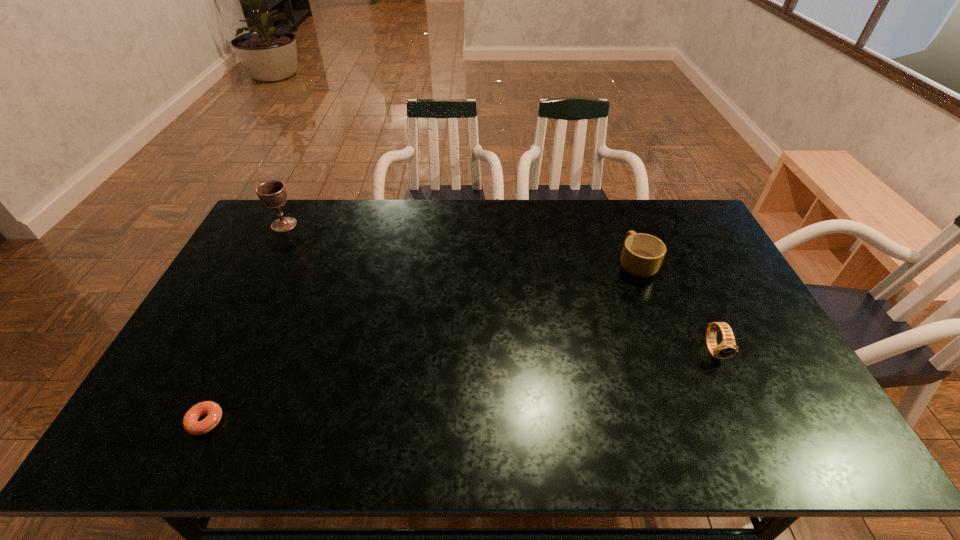
Identify the location of the farthest object. click(x=273, y=194).

In order to click on chalice in this screenshot , I will do `click(273, 194)`.

Identify the location of the second farthest object. (642, 255).

You are a GUI agent. You are given a task and a screenshot of the screen. Output one action in this format:
    pyautogui.click(x=<x>, y=<y>)
    Task: Click on the mug
    This screenshot has height=540, width=960.
    Given the screenshot: What is the action you would take?
    pyautogui.click(x=642, y=255)

Locate an element on the screen. Image resolution: width=960 pixels, height=540 pixels. watch is located at coordinates (727, 348).

You are a GUI agent. You are given a task and a screenshot of the screen. Output one action in this format:
    pyautogui.click(x=<x>, y=<y>)
    Task: Click on the rightmost object
    
    Given the screenshot: What is the action you would take?
    pyautogui.click(x=727, y=348)

Where is `the nearest object`? The height and width of the screenshot is (540, 960). the nearest object is located at coordinates (191, 424).

Image resolution: width=960 pixels, height=540 pixels. I want to click on doughnut, so click(191, 424).

Locate an element on the screen. The width and height of the screenshot is (960, 540). vacant space situated on the front of the farthest object is located at coordinates (275, 242).

Identify the location of free space located on the side with the handle of the third object from left to right. (623, 228).